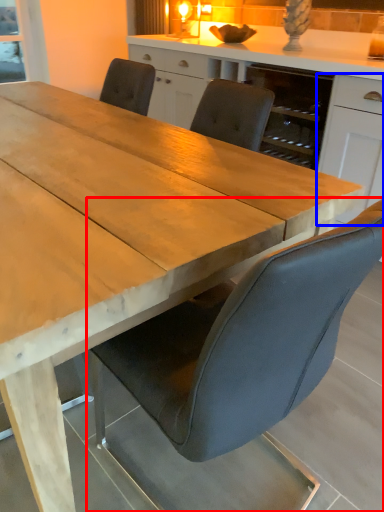
Question: Which object is closer to the camera taking this photo, chair (highlighted by a red box) or cabinetry (highlighted by a blue box)?

Choices:
 (A) chair
 (B) cabinetry

Answer: (A)